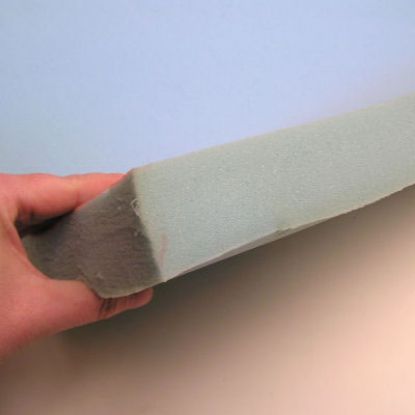
The image size is (415, 415). In order to click on foam in this screenshot , I will do `click(243, 224)`.